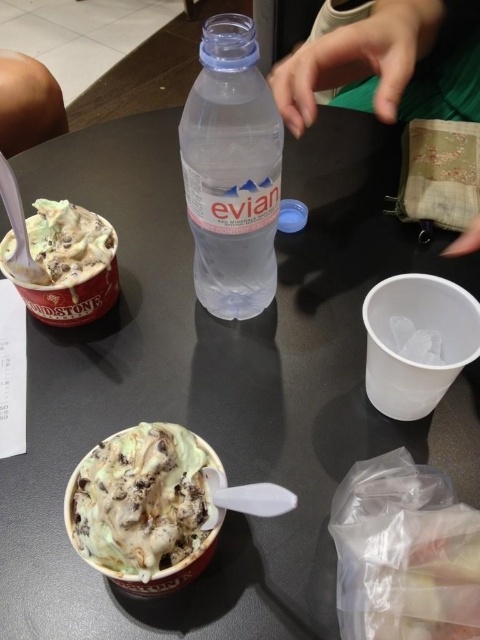
Looking at this image, you are at an ice cream shop and want to place a 6.5 inch wide book between the transparent plastic bottle at center and the green ice cream with chocolate chips at center. Will it fit?

The transparent plastic bottle at center is 7.60 inches from green ice cream with chocolate chips at center. Since the book is 6.5 inches wide, it will fit between them as there is enough space.

You are sitting at the table and want to reach both points on the table. Which point is closer to you, point (x=252, y=138) or point (x=86, y=499)?

Point (x=252, y=138) is closer to you because it is further to the viewer than point (x=86, y=499).